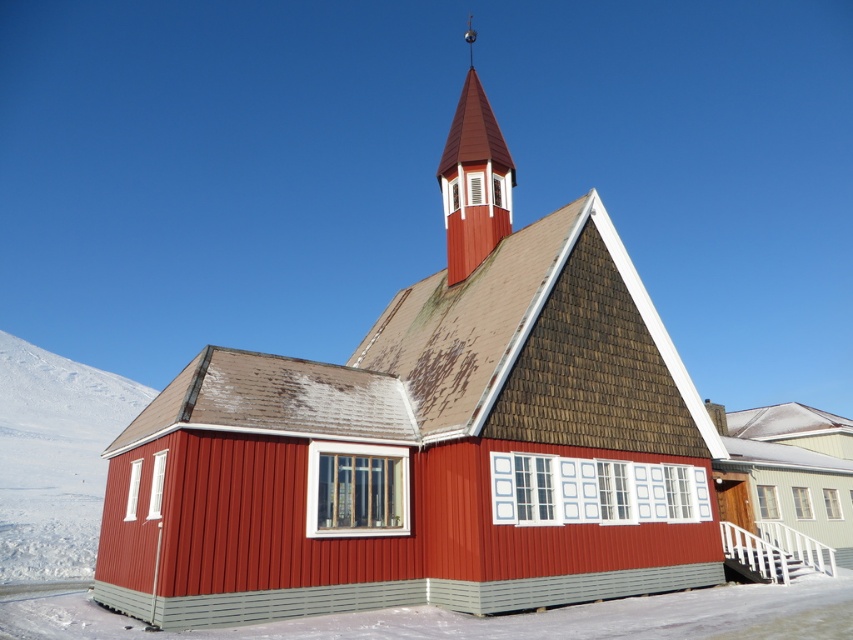
Question: In this image, where is smooth wooden chapel at center located relative to smooth red wood spire at upper center?

Choices:
 (A) right
 (B) left

Answer: (A)

Question: Is smooth wooden chapel at center positioned at the back of smooth red wood spire at upper center?

Choices:
 (A) no
 (B) yes

Answer: (A)

Question: Is smooth wooden chapel at center smaller than smooth red wood spire at upper center?

Choices:
 (A) yes
 (B) no

Answer: (B)